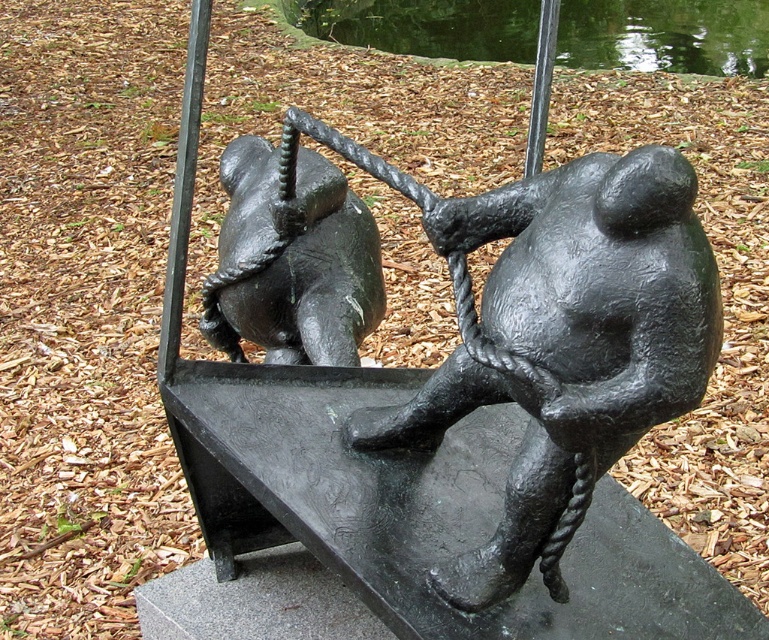
You are standing in front of the sculpture and want to touch the glossy reflective water at upper center. Is the black matte bear at center blocking your direct path to it?

The black matte bear at center is closer to the viewer than the glossy reflective water at upper center, so it would block your direct path to the glossy reflective water at upper center.

You are an art curator planning to display both the black matte sculpture at center and the black matte bear at center in a gallery. Given their sizes, which one would require more floor space to accommodate properly?

The black matte sculpture at center requires more floor space because it has a larger size compared to the black matte bear at center.